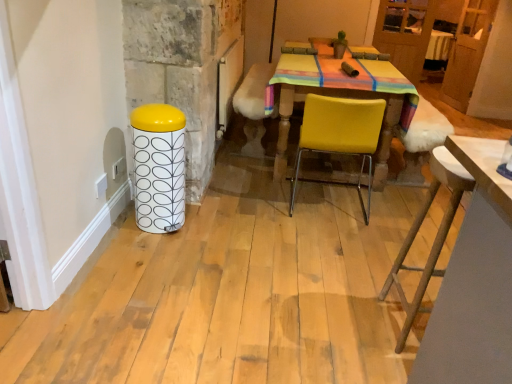
Identify the location of free space on the front side of white glossy trash can at left. (146, 247).